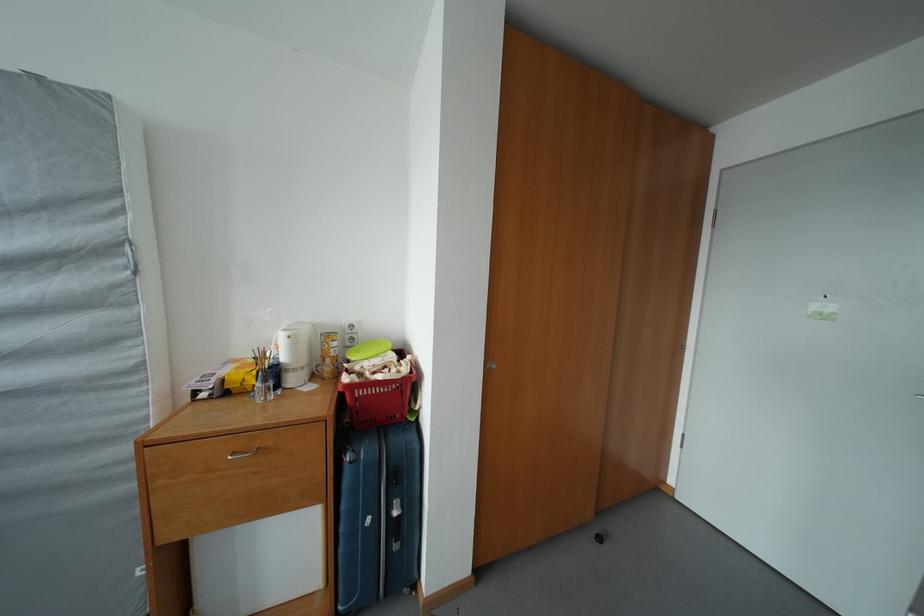
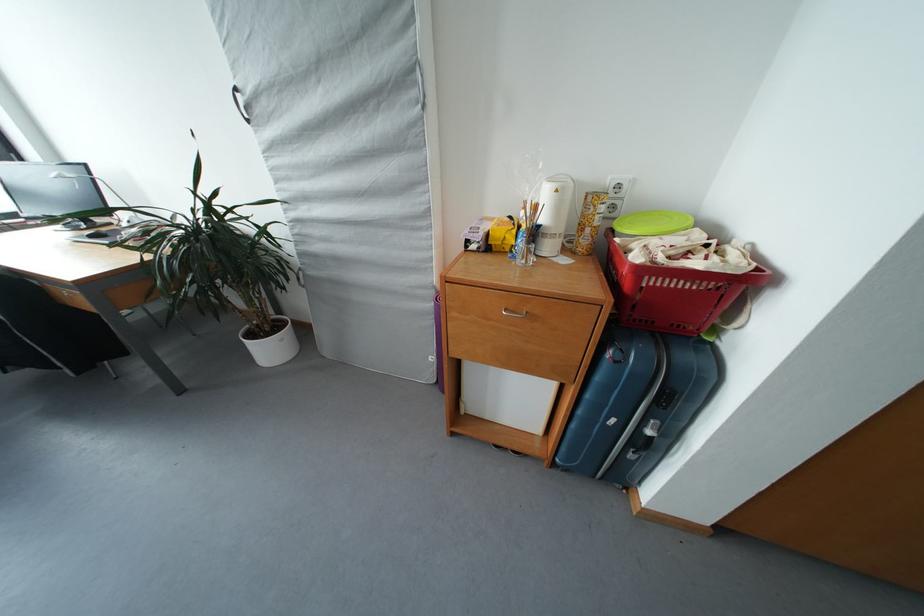
Find the pixel in the second image that matches pixel 347 554 in the first image.

(579, 431)